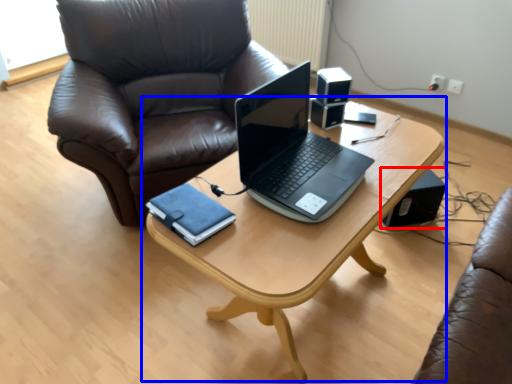
Question: Which object is further to the camera taking this photo, speaker (highlighted by a red box) or table (highlighted by a blue box)?

Choices:
 (A) speaker
 (B) table

Answer: (A)